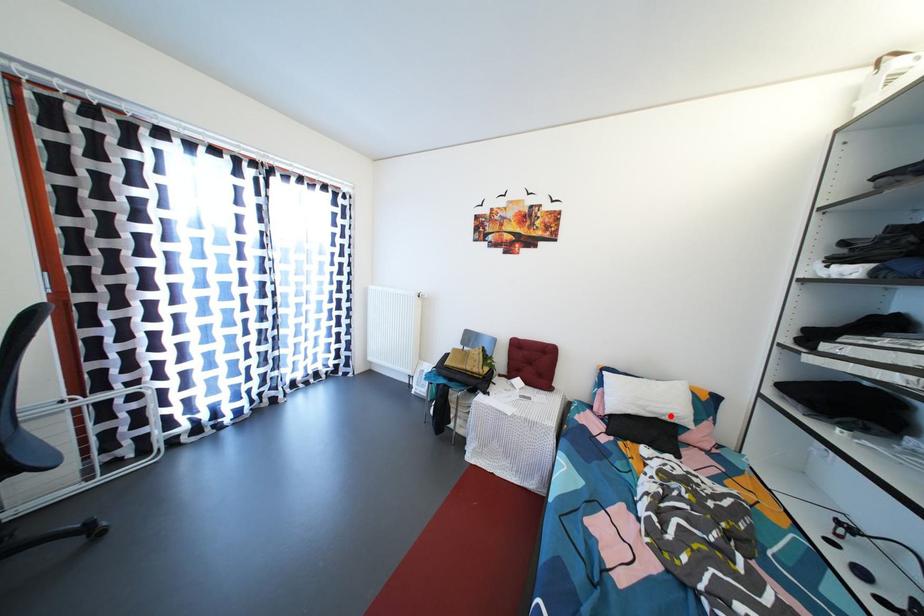
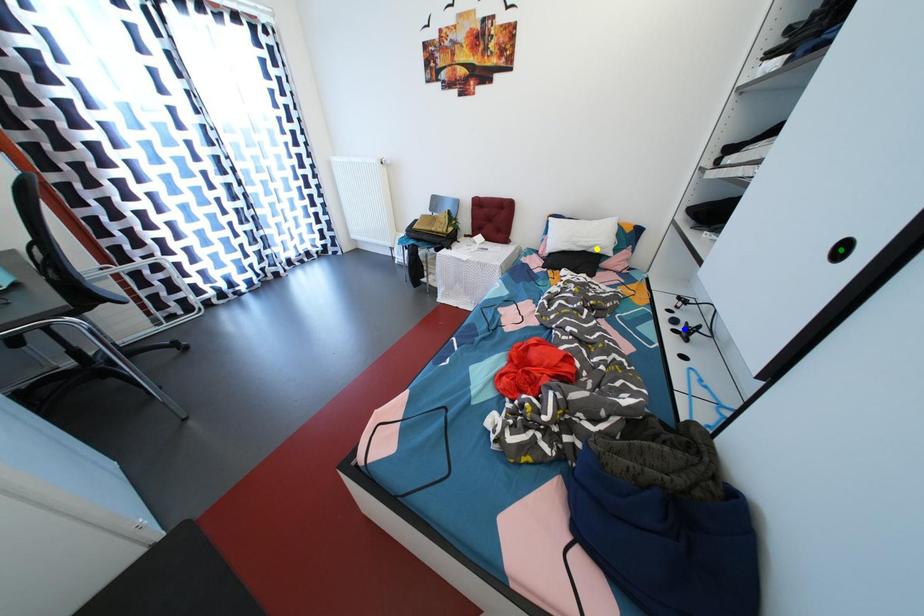
Question: I am providing you with two images of the same scene from different viewpoints. A red point is marked on the first image. You are given multiple points on the second image. Which point in image 2 is actually the same real-world point as the red point in image 1?

Choices:
 (A) blue point
 (B) yellow point
 (C) green point

Answer: (B)